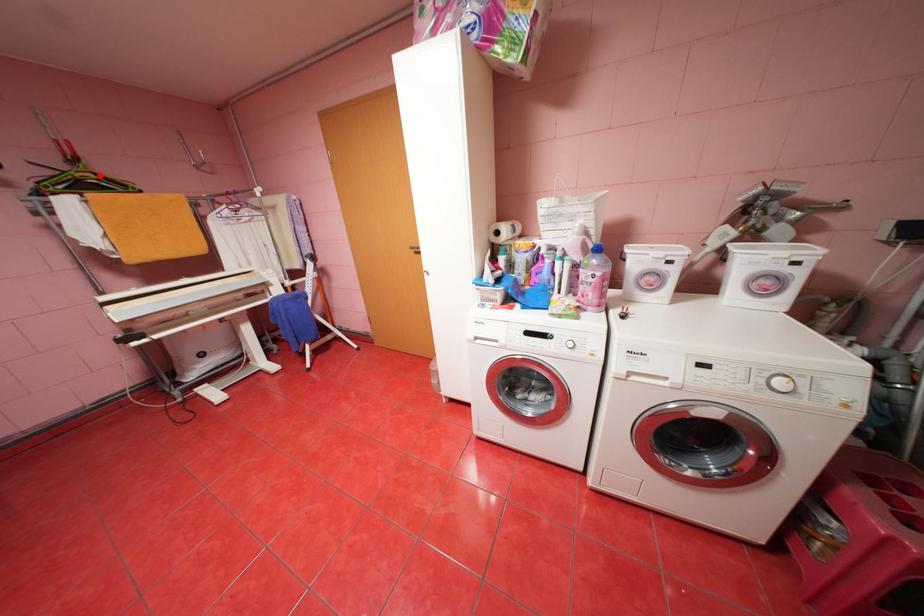
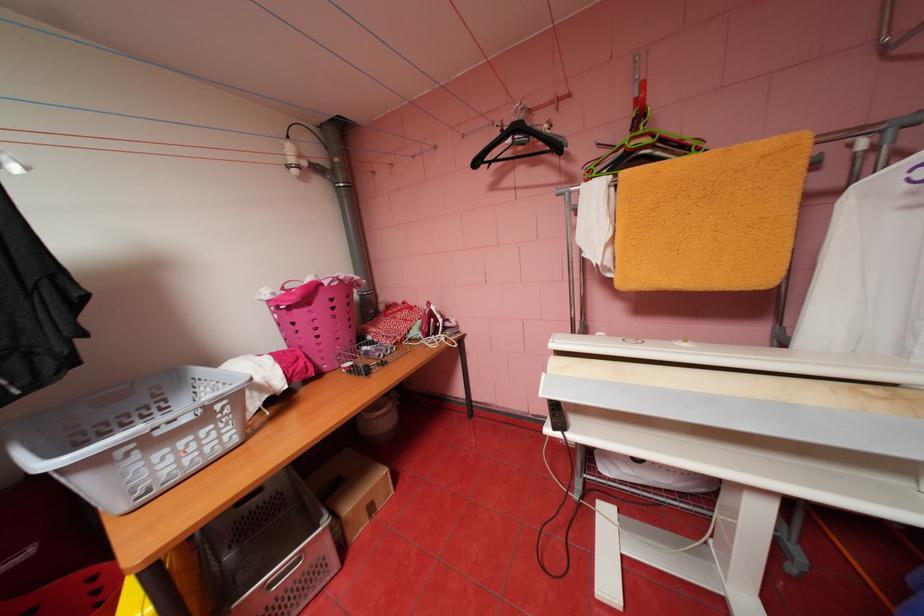
In the second image, find the point that corresponds to the highlighted location in the first image.

(655, 140)